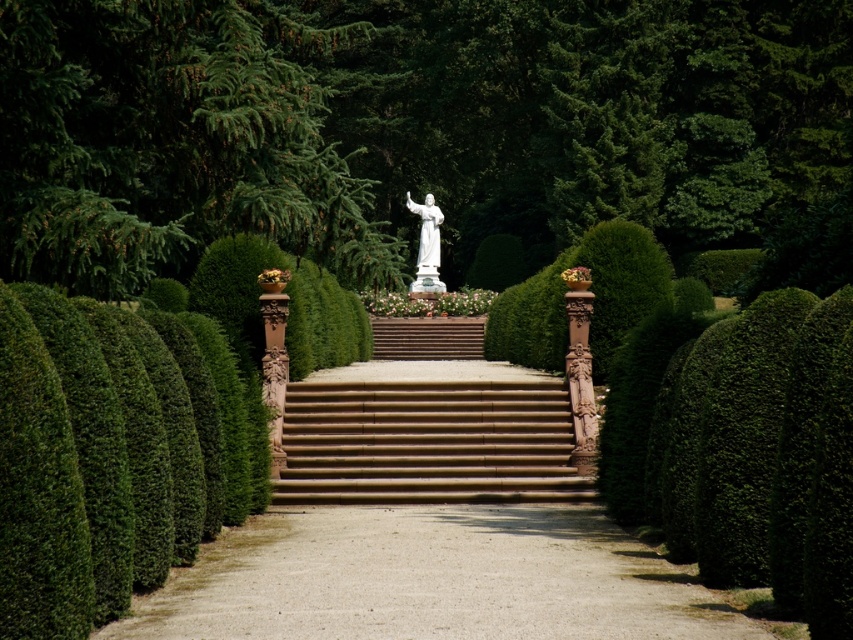
Does green leafy bush at upper center appear on the left side of brown stone stairs at center?

Yes, green leafy bush at upper center is to the left of brown stone stairs at center.

Looking at this image, can you confirm if green leafy bush at upper center is smaller than brown stone stairs at center?

Actually, green leafy bush at upper center might be larger than brown stone stairs at center.

Who is more distant from viewer, (187, 205) or (544, 440)?

Point (187, 205)

Identify the location of green leafy bush at upper center. (170, 141).

Can you confirm if green leafy bush at center is thinner than brown stone stairs at center?

Incorrect, green leafy bush at center's width is not less than brown stone stairs at center's.

Between point (643, 88) and point (299, 381), which one is positioned in front?

Point (299, 381) is more forward.

The width and height of the screenshot is (853, 640). What are the coordinates of `green leafy bush at center` in the screenshot? It's located at (408, 125).

Does green leafy bush at upper center have a larger size compared to dirt/gravel path at center?

Yes, green leafy bush at upper center is bigger than dirt/gravel path at center.

Between green leafy bush at upper center and dirt/gravel path at center, which one appears on the right side from the viewer's perspective?

dirt/gravel path at center is more to the right.

Describe the element at coordinates (170, 141) in the screenshot. Image resolution: width=853 pixels, height=640 pixels. I see `green leafy bush at upper center` at that location.

Locate an element on the screen. The image size is (853, 640). green leafy bush at upper center is located at coordinates (170, 141).